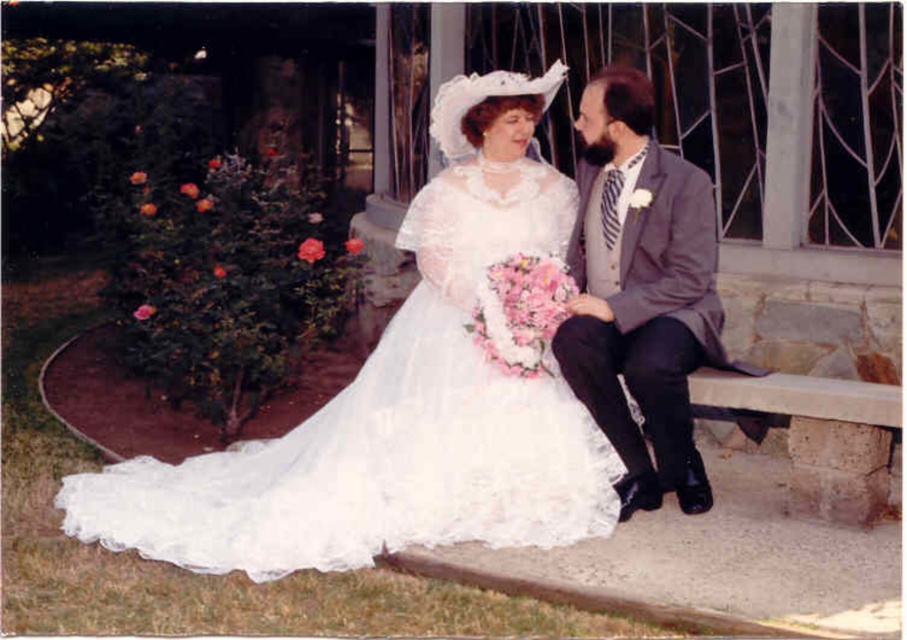
Question: Does white lace dress at center have a larger size compared to gray wool suit at right?

Choices:
 (A) yes
 (B) no

Answer: (A)

Question: Is the position of white lace dress at center less distant than that of gray wool suit at right?

Choices:
 (A) yes
 (B) no

Answer: (A)

Question: Which of the following is the farthest from the observer?

Choices:
 (A) (698, 353)
 (B) (135, 486)

Answer: (B)

Question: Does white lace dress at center appear on the left side of gray wool suit at right?

Choices:
 (A) yes
 (B) no

Answer: (A)